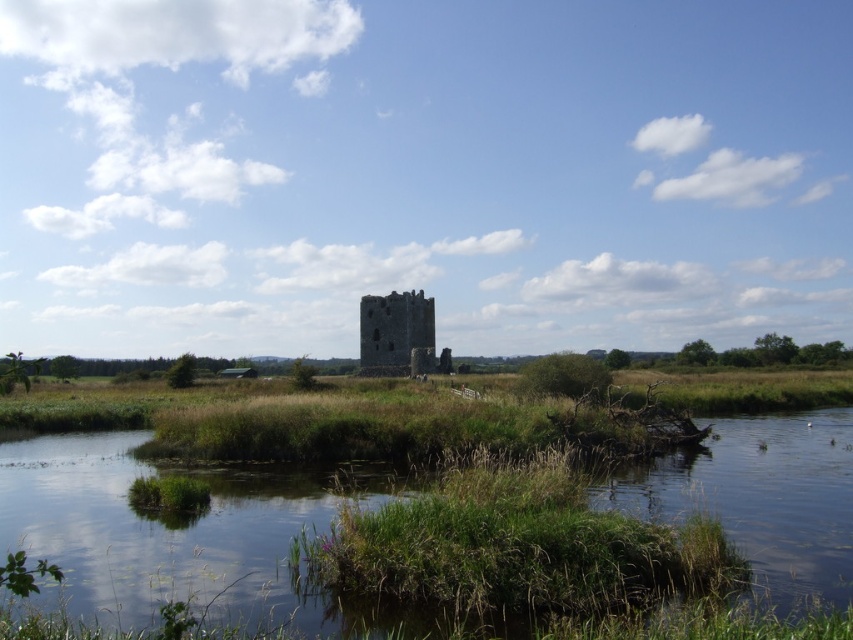
You are standing at the camera position and want to reach the point marked as point (323, 528). Can you walk directly to it without any obstacles? Please consider the distance and the environment described.

The distance between your current position and point (323, 528) is 49.36 meters. Since the path is surrounded by lush vegetation and a natural moat, you can walk directly to the point as there are no mentioned obstacles blocking the path.

You are standing at the edge of the green grassy river at lower center. What are the coordinates of your current position?

The coordinates of the green grassy river at lower center are at point (160, 531).

You are standing at the base of the historic stone tower in the center of the image. You want to cross to the other side of the green grassy river at lower center. There is a point marked at coordinates point (160, 531). Is this point on the green grassy river at lower center a safe path to cross the river?

The point (160, 531) is on the green grassy river at lower center, so it is part of the river itself. Therefore, this point is not a safe path to cross the river since it is located within the water area.